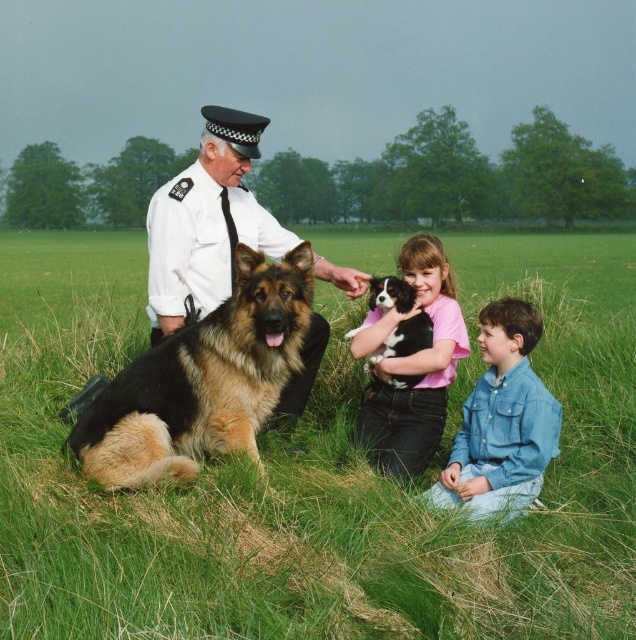
Can you confirm if green grass at center is wider than brown and black fur at left?

Yes, green grass at center is wider than brown and black fur at left.

Is point (466, 300) farther from camera compared to point (275, 381)?

That is True.

Identify the location of green grass at center. (315, 472).

Who is taller, green grass at center or denim shirt at lower right?

green grass at center

Find the location of a particular element. green grass at center is located at coordinates (315, 472).

The width and height of the screenshot is (636, 640). In order to click on green grass at center in this screenshot , I will do `click(315, 472)`.

Locate an element on the screen. Image resolution: width=636 pixels, height=640 pixels. brown and black fur at left is located at coordinates (202, 381).

Between brown and black fur at left and denim shirt at lower right, which one is positioned lower?

Positioned lower is denim shirt at lower right.

Consider the image. Who is more forward, (x=121, y=474) or (x=445, y=476)?

Point (x=121, y=474) is in front.

At what (x,y) coordinates should I click in order to perform the action: click on brown and black fur at left. Please return your answer as a coordinate pair (x, y). Looking at the image, I should click on (202, 381).